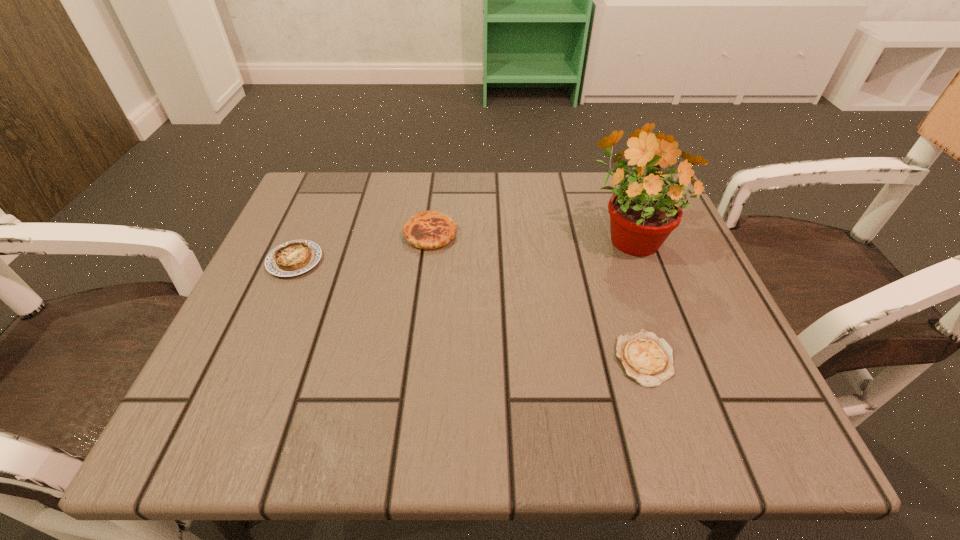
This screenshot has width=960, height=540. Identify the location of free space between the shortest object and the tallest object. (636, 298).

At what (x,y) coordinates should I click in order to perform the action: click on empty location between the nearest quiche and the second shortest object. Please return your answer as a coordinate pair (x, y). Image resolution: width=960 pixels, height=540 pixels. Looking at the image, I should click on (469, 310).

The height and width of the screenshot is (540, 960). I want to click on object that can be found as the third closest to the shortest object, so click(x=292, y=258).

Locate an element on the screen. object that is the closest one to the nearest object is located at coordinates (643, 213).

Select which quiche is the second closest to the second tallest object. Please provide its 2D coordinates. Your answer should be formatted as a tuple, i.e. [(x, y)], where the tuple contains the x and y coordinates of a point satisfying the conditions above.

[(645, 358)]

The width and height of the screenshot is (960, 540). I want to click on the third closest quiche to the flowerpot, so click(x=292, y=258).

Find the location of a particular element. free space that satisfies the following two spatial constraints: 1. on the front side of the nearest object; 2. on the right side of the third tallest object is located at coordinates (252, 360).